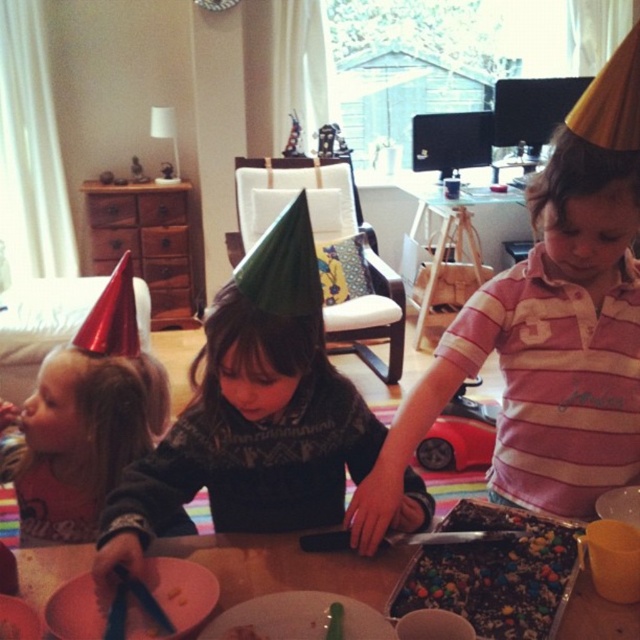
Which is more to the left, green felt party hat at center or chocolate cake with colorful candies at center?

Positioned to the left is green felt party hat at center.

Can you confirm if green felt party hat at center is positioned to the left of chocolate cake with colorful candies at center?

Yes, green felt party hat at center is to the left of chocolate cake with colorful candies at center.

Is point (113, 516) closer to camera compared to point (552, 538)?

Yes.

The image size is (640, 640). Identify the location of green felt party hat at center. (253, 413).

Describe the element at coordinates (545, 348) in the screenshot. I see `pink striped shirt at center` at that location.

Does pink striped shirt at center appear over green felt party hat at center?

Yes.

Where is `pink striped shirt at center`? This screenshot has width=640, height=640. pink striped shirt at center is located at coordinates (545, 348).

You are a GUI agent. You are given a task and a screenshot of the screen. Output one action in this format:
    pyautogui.click(x=<x>, y=<y>)
    Task: Click on the pink striped shirt at center
    
    Given the screenshot: What is the action you would take?
    pyautogui.click(x=545, y=348)

Looking at this image, is wooden table at center further to camera compared to chocolate cake with colorful candies at center?

Yes, it is.

Between wooden table at center and chocolate cake with colorful candies at center, which one has less height?

wooden table at center is shorter.

Between point (566, 627) and point (573, 576), which one is positioned behind?

Positioned behind is point (573, 576).

I want to click on wooden table at center, so click(288, 566).